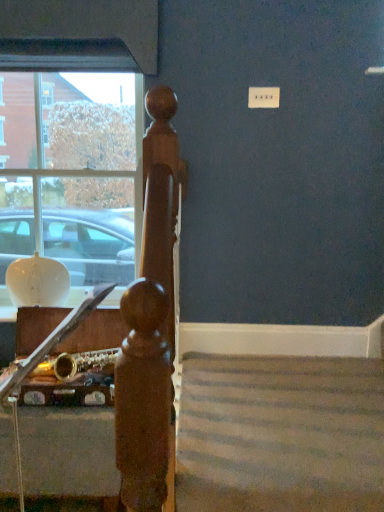
This screenshot has height=512, width=384. What do you see at coordinates (70, 165) in the screenshot?
I see `clear glass window at upper left` at bounding box center [70, 165].

Locate an element on the screen. clear glass window at upper left is located at coordinates (70, 165).

Measure the distance between clear glass window at upper left and camera.

The depth of clear glass window at upper left is 6.51 feet.

This screenshot has width=384, height=512. Find the location of `gold metallic saxophone at lower left`. gold metallic saxophone at lower left is located at coordinates (x=97, y=332).

The width and height of the screenshot is (384, 512). What do you see at coordinates (97, 332) in the screenshot? I see `gold metallic saxophone at lower left` at bounding box center [97, 332].

Identify the location of clear glass window at upper left. The image size is (384, 512). (70, 165).

Considering the positions of objects gold metallic saxophone at lower left and clear glass window at upper left in the image provided, who is more to the left, gold metallic saxophone at lower left or clear glass window at upper left?

From the viewer's perspective, clear glass window at upper left appears more on the left side.

Which object is more forward, gold metallic saxophone at lower left or clear glass window at upper left?

gold metallic saxophone at lower left.

Which is in front, point (94, 334) or point (66, 48)?

The point (66, 48) is more forward.

From the image's perspective, is gold metallic saxophone at lower left above or below clear glass window at upper left?

Based on their image positions, gold metallic saxophone at lower left is located beneath clear glass window at upper left.

From a real-world perspective, is gold metallic saxophone at lower left physically located above or below clear glass window at upper left?

From a real-world perspective, gold metallic saxophone at lower left is physically below clear glass window at upper left.

Does gold metallic saxophone at lower left have a lesser width compared to clear glass window at upper left?

No, gold metallic saxophone at lower left is not thinner than clear glass window at upper left.

Can you confirm if gold metallic saxophone at lower left is shorter than clear glass window at upper left?

Indeed, gold metallic saxophone at lower left has a lesser height compared to clear glass window at upper left.

Is gold metallic saxophone at lower left bigger or smaller than clear glass window at upper left?

Clearly, gold metallic saxophone at lower left is larger in size than clear glass window at upper left.

Is gold metallic saxophone at lower left not inside clear glass window at upper left?

gold metallic saxophone at lower left lies outside clear glass window at upper left's area.

Is gold metallic saxophone at lower left placed right next to clear glass window at upper left?

gold metallic saxophone at lower left is not next to clear glass window at upper left, and they're not touching.

Is gold metallic saxophone at lower left facing away from clear glass window at upper left?

That's not correct — gold metallic saxophone at lower left is not looking away from clear glass window at upper left.

What's the angular difference between gold metallic saxophone at lower left and clear glass window at upper left's facing directions?

The angle between the facing direction of gold metallic saxophone at lower left and the facing direction of clear glass window at upper left is 90.2 degrees.

Measure the distance from gold metallic saxophone at lower left to clear glass window at upper left.

gold metallic saxophone at lower left is 75.70 centimeters away from clear glass window at upper left.

This screenshot has height=512, width=384. Find the location of `furniture that is under the clear glass window at upper left (from a real-world perspective)`. furniture that is under the clear glass window at upper left (from a real-world perspective) is located at coordinates (97, 332).

Is clear glass window at upper left at the left side of gold metallic saxophone at lower left?

Indeed, clear glass window at upper left is positioned on the left side of gold metallic saxophone at lower left.

Which object is further away from the camera, clear glass window at upper left or gold metallic saxophone at lower left?

clear glass window at upper left is more distant.

Which point is more forward, [129,58] or [46,327]?

Positioned in front is point [129,58].

From the image's perspective, which one is positioned higher, clear glass window at upper left or gold metallic saxophone at lower left?

clear glass window at upper left is shown above in the image.

From a real-world perspective, is clear glass window at upper left positioned under gold metallic saxophone at lower left based on gravity?

No, from a real-world perspective, clear glass window at upper left is not below gold metallic saxophone at lower left.

Looking at their sizes, would you say clear glass window at upper left is wider or thinner than gold metallic saxophone at lower left?

Considering their sizes, clear glass window at upper left looks slimmer than gold metallic saxophone at lower left.

Is clear glass window at upper left taller or shorter than gold metallic saxophone at lower left?

clear glass window at upper left is taller than gold metallic saxophone at lower left.

In terms of size, does clear glass window at upper left appear bigger or smaller than gold metallic saxophone at lower left?

clear glass window at upper left is smaller than gold metallic saxophone at lower left.

Is clear glass window at upper left outside of gold metallic saxophone at lower left?

Yes.

From the picture: Would you consider clear glass window at upper left to be distant from gold metallic saxophone at lower left?

Actually, clear glass window at upper left and gold metallic saxophone at lower left are a little close together.

Is clear glass window at upper left positioned with its back to gold metallic saxophone at lower left?

No, clear glass window at upper left is not facing the opposite direction of gold metallic saxophone at lower left.

Measure the distance from clear glass window at upper left to gold metallic saxophone at lower left.

clear glass window at upper left and gold metallic saxophone at lower left are 29.80 inches apart.

The width and height of the screenshot is (384, 512). In order to click on furniture that appears on the right of clear glass window at upper left in this screenshot , I will do `click(97, 332)`.

The height and width of the screenshot is (512, 384). Identify the location of furniture on the right of clear glass window at upper left. (97, 332).

Identify the location of window behind the gold metallic saxophone at lower left. (70, 165).